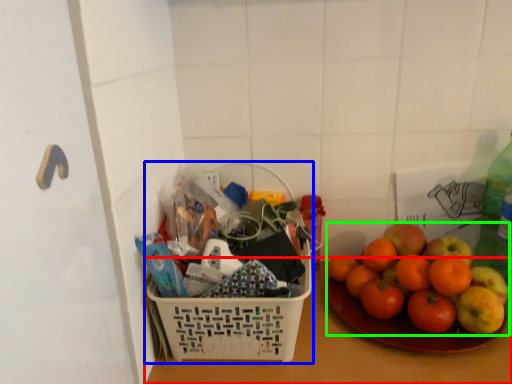
Question: Estimate the real-world distances between objects in this image. Which object is closer to table top (highlighted by a red box), basket (highlighted by a blue box) or grapefruit (highlighted by a green box)?

Choices:
 (A) basket
 (B) grapefruit

Answer: (B)